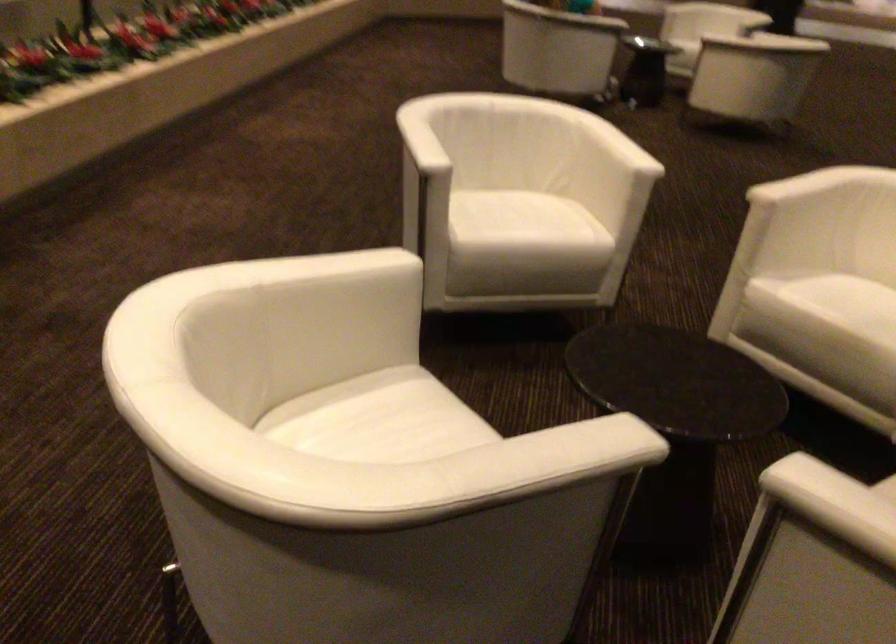
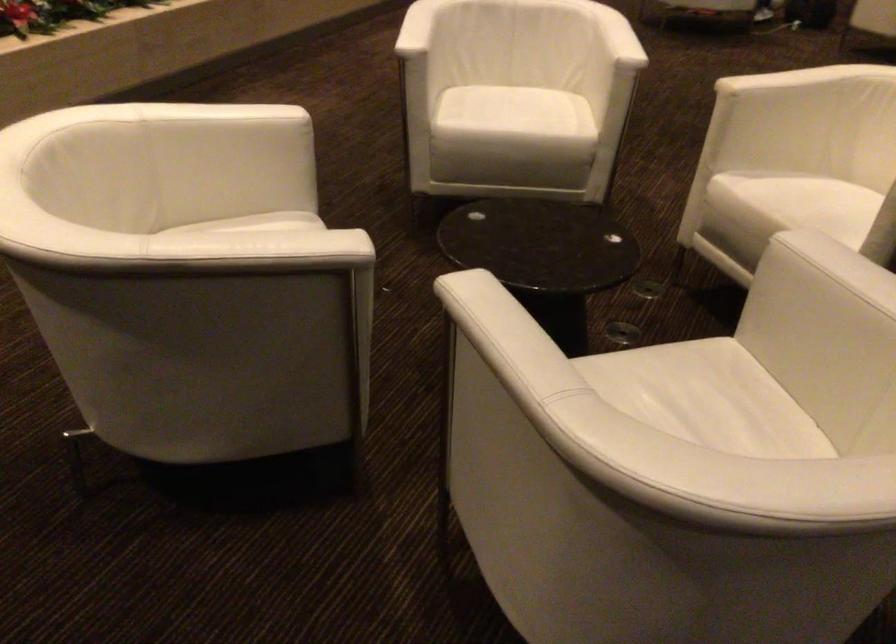
Find the pixel in the second image that matches pixel 383 388 in the first image.

(265, 223)